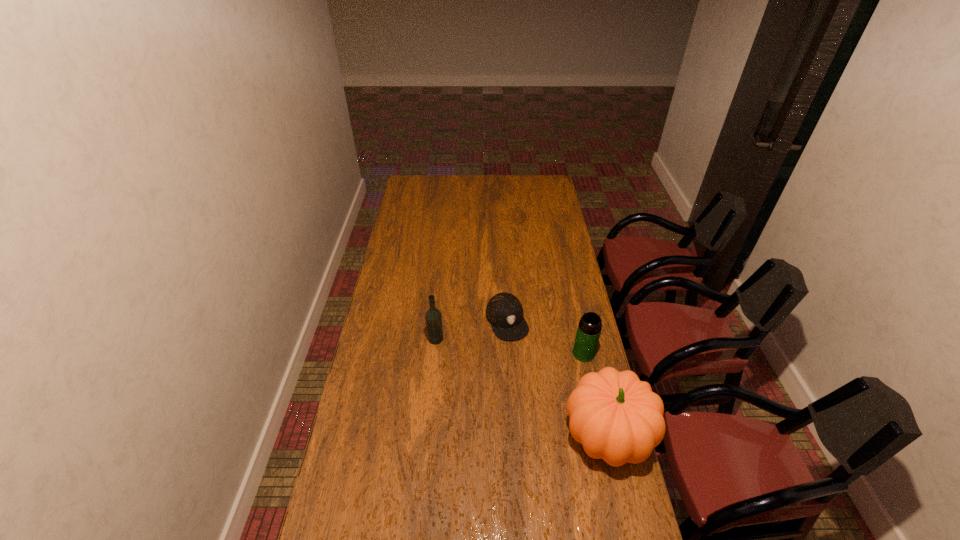
Where is `the leftmost object`? This screenshot has width=960, height=540. the leftmost object is located at coordinates (433, 316).

You are a GUI agent. You are given a task and a screenshot of the screen. Output one action in this format:
    pyautogui.click(x=<x>, y=<y>)
    Task: Click on the pumpkin
    
    Given the screenshot: What is the action you would take?
    pyautogui.click(x=616, y=417)

You are a GUI agent. You are given a task and a screenshot of the screen. Output one action in this format:
    pyautogui.click(x=<x>, y=<y>)
    Task: Click on the second object from left to right
    The height and width of the screenshot is (540, 960).
    Given the screenshot: What is the action you would take?
    pyautogui.click(x=504, y=311)

I want to click on cap, so click(504, 311).

Locate an element on the screen. thermos bottle is located at coordinates (589, 328).

You are a GUI agent. You are given a task and a screenshot of the screen. Output one action in this format:
    pyautogui.click(x=<x>, y=<y>)
    Task: Click on the vacant space located 0.370m on the front of the vodka
    The width and height of the screenshot is (960, 540).
    Given the screenshot: What is the action you would take?
    pyautogui.click(x=427, y=431)

Find the location of `vacant space located 0.260m on the back of the pumpkin`. vacant space located 0.260m on the back of the pumpkin is located at coordinates (586, 341).

Identify the location of vacant space located on the front-facing side of the cap. (532, 384).

Locate an element on the screen. The width and height of the screenshot is (960, 540). vacant space located 0.230m on the front-facing side of the cap is located at coordinates (534, 389).

Find the location of a particular element. Image resolution: width=960 pixels, height=540 pixels. free space located 0.170m on the front-facing side of the cap is located at coordinates (528, 376).